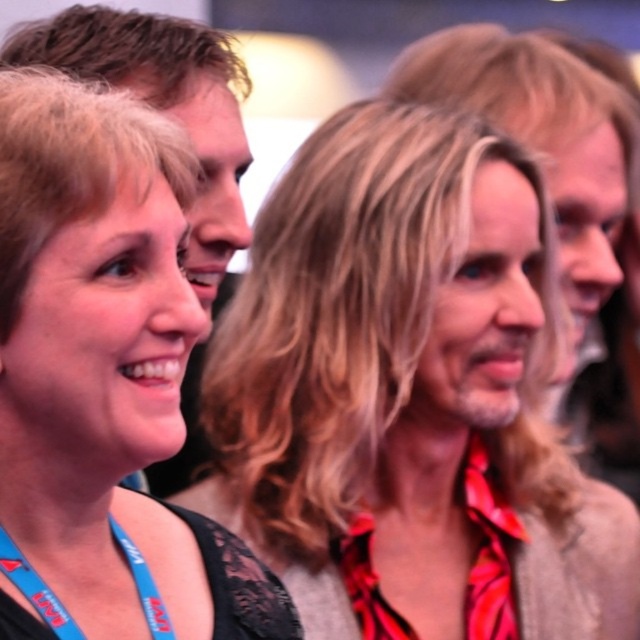
Does matte black shirt at center have a larger size compared to matte black neck at lower left?

Yes, matte black shirt at center is bigger than matte black neck at lower left.

Can you confirm if matte black shirt at center is positioned to the right of matte black neck at lower left?

Indeed, matte black shirt at center is positioned on the right side of matte black neck at lower left.

Where is `matte black shirt at center`? matte black shirt at center is located at coordinates (408, 390).

Between matte black neck at lower left and reddish-brown fabric at center, which one has more height?

reddish-brown fabric at center is taller.

The width and height of the screenshot is (640, 640). Describe the element at coordinates (61, 467) in the screenshot. I see `matte black neck at lower left` at that location.

Does point (38, 515) lie behind point (460, 509)?

No.

Find the location of a particular element. This screenshot has width=640, height=640. matte black neck at lower left is located at coordinates (61, 467).

Is point (339, 333) behind point (388, 468)?

No.

Is matte black shirt at center to the left of reddish-brown fabric at center from the viewer's perspective?

Correct, you'll find matte black shirt at center to the left of reddish-brown fabric at center.

Who is more distant from viewer, (506, 168) or (454, 404)?

The point (506, 168) is behind.

Identify the location of matte black shirt at center. (408, 390).